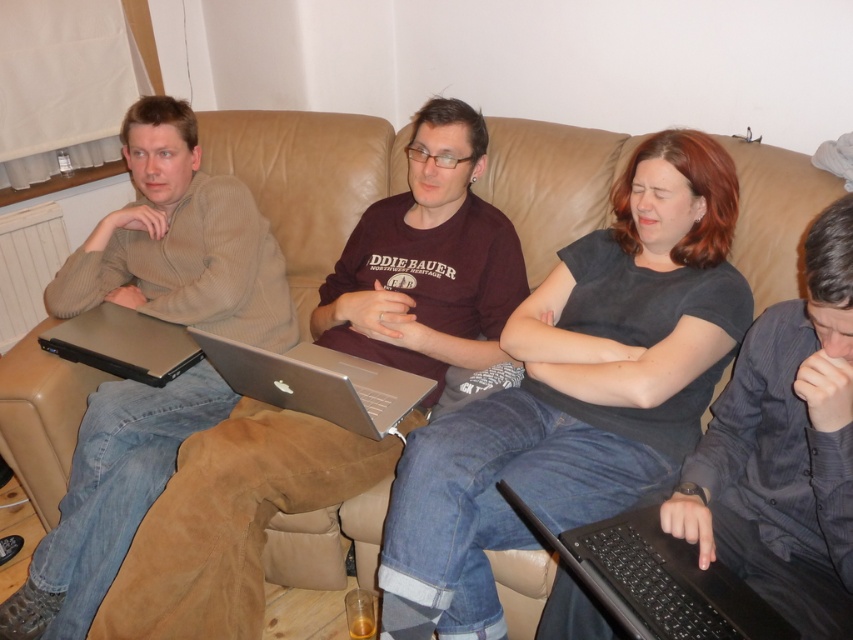
What is located at the coordinates point (575, 392)?

The dark gray matte shirt at center is located at point (575, 392).

You are a photographer trying to capture a candid shot of the dark gray matte shirt at center and the silver metallic laptop at center. Since you want to focus on both subjects, which one should you adjust your camera focus on first to ensure both are in frame?

The dark gray matte shirt at center is located below the silver metallic laptop at center, so you should focus on the silver metallic laptop at center first to ensure both are in frame.

In the scene, there are two people wearing the matte brown sweater at left and the dark gray shirt at center. Which one is positioned more to the left side of the image?

The matte brown sweater at left is positioned more to the left side of the image than the dark gray shirt at center.